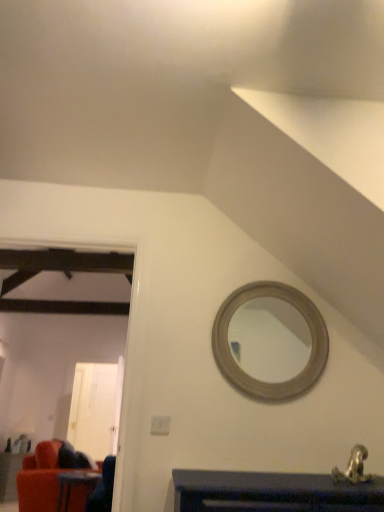
Question: From their relative heights in the image, would you say wooden table at lower left, which ranks as the 2th table in left-to-right order, is taller or shorter than velvet red couch at lower left, arranged as the 1th table when viewed from the back?

Choices:
 (A) short
 (B) tall

Answer: (A)

Question: From a real-world perspective, is wooden table at lower left, which ranks as the 2th table in left-to-right order, above or below velvet red couch at lower left, the first table in the bottom-to-top sequence?

Choices:
 (A) above
 (B) below

Answer: (A)

Question: Based on their relative distances, which object is nearer to the white glossy door at left?

Choices:
 (A) wooden table at lower left, placed as the 1th table when sorted from top to bottom
 (B) velvet red couch at lower left, acting as the second table starting from the right
 (C) metallic silver faucet at lower right

Answer: (B)

Question: Which object is positioned closest to the white glossy door at left?

Choices:
 (A) velvet red couch at lower left, acting as the 2th table starting from the front
 (B) metallic silver faucet at lower right
 (C) wooden table at lower left, acting as the first table starting from the front

Answer: (A)